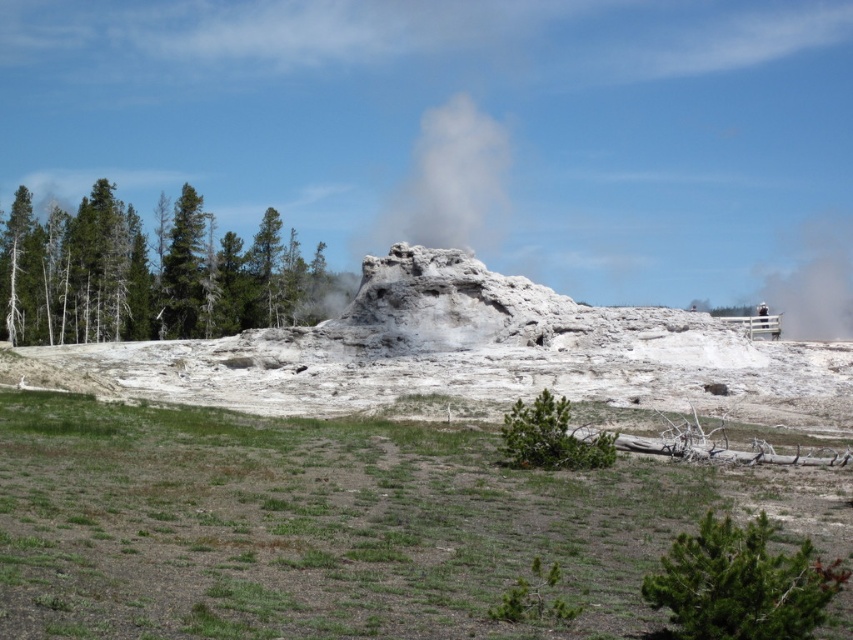
You are standing at the center of the scene. Which direction should you walk to reach the green coniferous trees located at point (x=149, y=273)?

The green coniferous trees at point (x=149, y=273) are located to the left of the scene, so you should walk to the left to reach them.